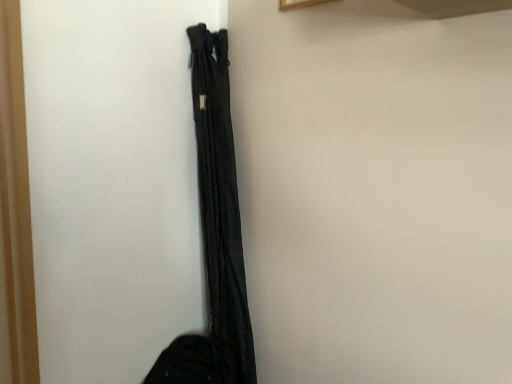
Question: Is black fabric bag at upper right wider or thinner than black fabric curtain at center?

Choices:
 (A) wide
 (B) thin

Answer: (A)

Question: Which is correct: black fabric bag at upper right is inside black fabric curtain at center, or outside of it?

Choices:
 (A) inside
 (B) outside

Answer: (B)

Question: In terms of size, does black fabric bag at upper right appear bigger or smaller than black fabric curtain at center?

Choices:
 (A) big
 (B) small

Answer: (A)

Question: In the image, is black fabric curtain at center positioned in front of or behind black fabric bag at upper right?

Choices:
 (A) front
 (B) behind

Answer: (B)

Question: Is black fabric curtain at center situated inside black fabric bag at upper right or outside?

Choices:
 (A) inside
 (B) outside

Answer: (B)

Question: In terms of size, does black fabric curtain at center appear bigger or smaller than black fabric bag at upper right?

Choices:
 (A) big
 (B) small

Answer: (B)

Question: Is black fabric curtain at center taller or shorter than black fabric bag at upper right?

Choices:
 (A) short
 (B) tall

Answer: (B)